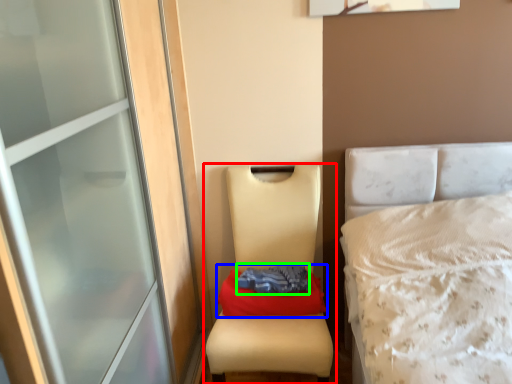
Question: Which object is the farthest from furniture (highlighted by a red box)? Choose among these: material (highlighted by a blue box) or clothing (highlighted by a green box).

Choices:
 (A) material
 (B) clothing

Answer: (A)